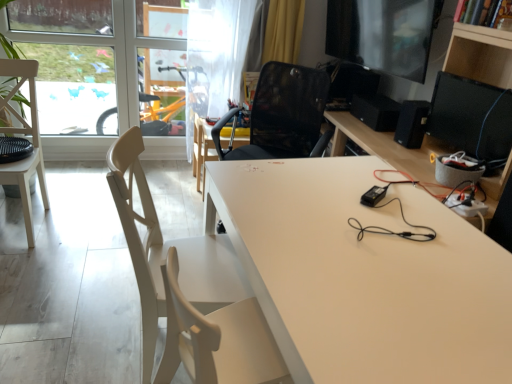
Where is `free spot to the right of white wood chair at left, positioned as the 2th chair in front-to-back order`? The height and width of the screenshot is (384, 512). free spot to the right of white wood chair at left, positioned as the 2th chair in front-to-back order is located at coordinates (81, 229).